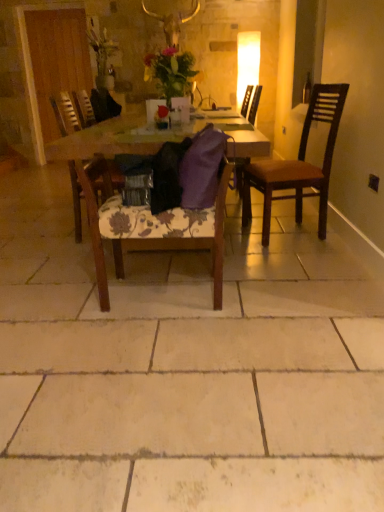
This screenshot has width=384, height=512. I want to click on vacant region under wooden chair at center, which ranks as the second chair in left-to-right order (from a real-world perspective), so click(166, 291).